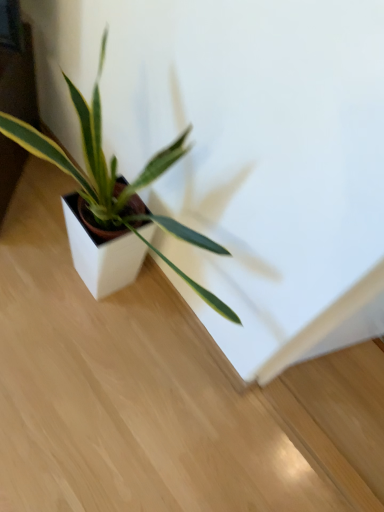
Locate an element on the screen. free point below green matte plant at center-left (from a real-world perspective) is located at coordinates [110, 330].